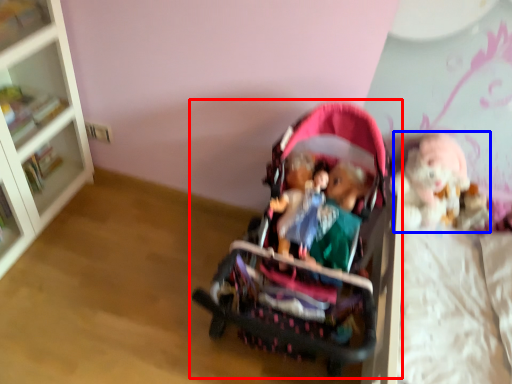
Question: Among these objects, which one is farthest to the camera, toy (highlighted by a red box) or doll (highlighted by a blue box)?

Choices:
 (A) toy
 (B) doll

Answer: (B)